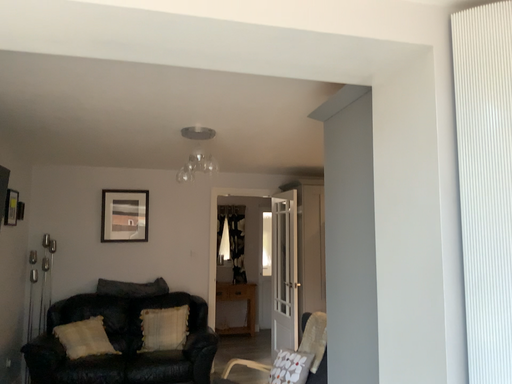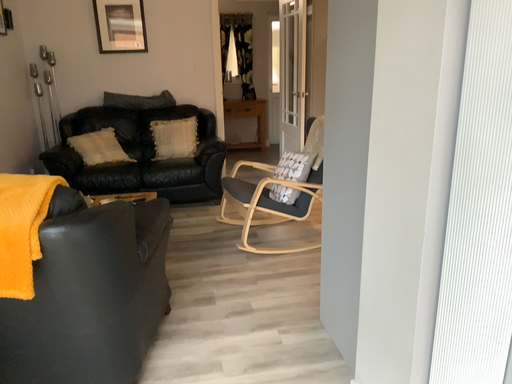
Question: Which way did the camera rotate in the video?

Choices:
 (A) rotated downward
 (B) rotated upward

Answer: (A)